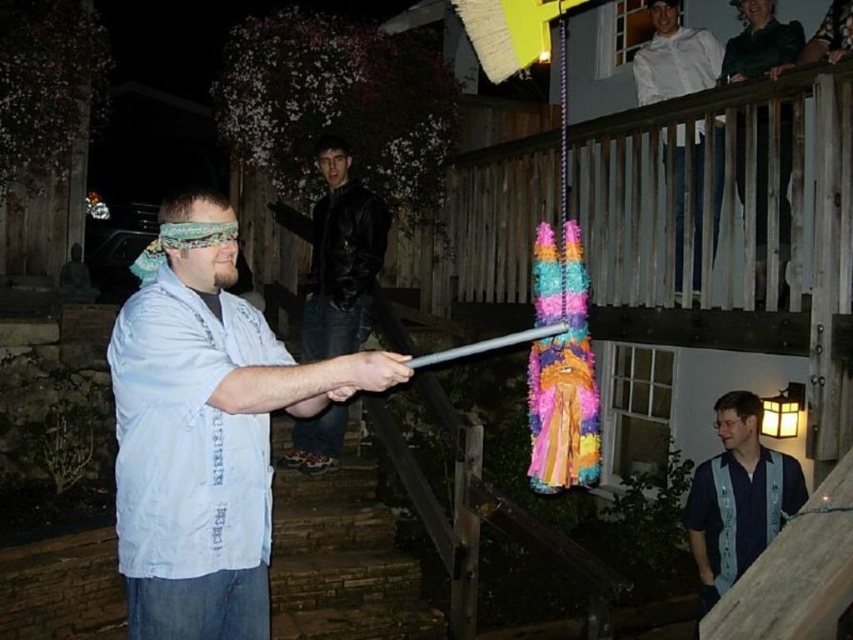
Is the position of white cotton shirt at center less distant than that of white shirt at upper right?

That is True.

Who is more distant from viewer, (260, 604) or (660, 56)?

The point (660, 56) is behind.

Where is `white cotton shirt at center`? The width and height of the screenshot is (853, 640). white cotton shirt at center is located at coordinates (206, 429).

Between white cotton shirt at center and black leather jacket at upper center, which one has more height?

white cotton shirt at center

Find the location of a particular element. white cotton shirt at center is located at coordinates (206, 429).

Who is more distant from viewer, [341,140] or [752,532]?

Positioned behind is point [341,140].

Can you confirm if black leather jacket at upper center is smaller than blue striped shirt at center?

Actually, black leather jacket at upper center might be larger than blue striped shirt at center.

Is point (334, 236) positioned before point (750, 525)?

That is False.

Where is `black leather jacket at upper center`? The width and height of the screenshot is (853, 640). black leather jacket at upper center is located at coordinates (341, 257).